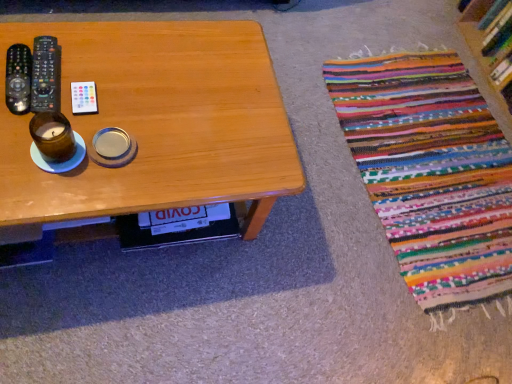
Question: From the image's perspective, is wooden bookshelf at upper right positioned above or below white plastic remote control at upper left, which is counted as the 1th remote control, starting from the right?

Choices:
 (A) above
 (B) below

Answer: (A)

Question: In the image, is wooden bookshelf at upper right on the left side or the right side of white plastic remote control at upper left, which is counted as the 1th remote control, starting from the right?

Choices:
 (A) left
 (B) right

Answer: (B)

Question: Which object is the farthest from the wooden bookshelf at upper right?

Choices:
 (A) black plastic remote at left, the 2th remote control when ordered from left to right
 (B) wooden table at center
 (C) black plastic remote control at left, which appears as the 1th remote control when viewed from the left
 (D) brown glass candle at left
 (E) white plastic remote control at upper left, which is counted as the 1th remote control, starting from the right

Answer: (C)

Question: Which of these objects is positioned closest to the black plastic remote control at left, which appears as the 1th remote control when viewed from the left?

Choices:
 (A) wooden table at center
 (B) white plastic remote control at upper left, the third remote control when ordered from left to right
 (C) wooden bookshelf at upper right
 (D) black plastic remote at left, the 2th remote control in the right-to-left sequence
 (E) brown glass candle at left

Answer: (D)